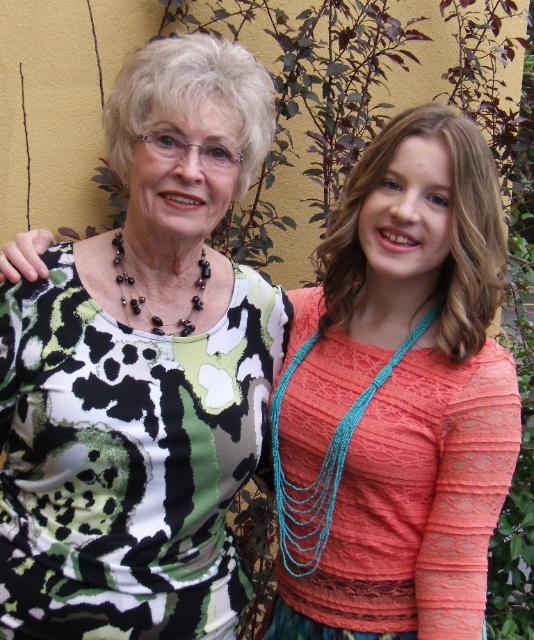
Question: Among these objects, which one is nearest to the camera?

Choices:
 (A) coral lace top at center
 (B) printed fabric dress at center

Answer: (B)

Question: Does coral lace top at center have a lesser width compared to printed fabric dress at center?

Choices:
 (A) no
 (B) yes

Answer: (B)

Question: Is coral lace top at center to the right of printed fabric dress at center from the viewer's perspective?

Choices:
 (A) yes
 (B) no

Answer: (A)

Question: Which of the following is the closest to the observer?

Choices:
 (A) coral lace top at center
 (B) printed fabric dress at center

Answer: (B)

Question: Is coral lace top at center in front of printed fabric dress at center?

Choices:
 (A) no
 (B) yes

Answer: (A)